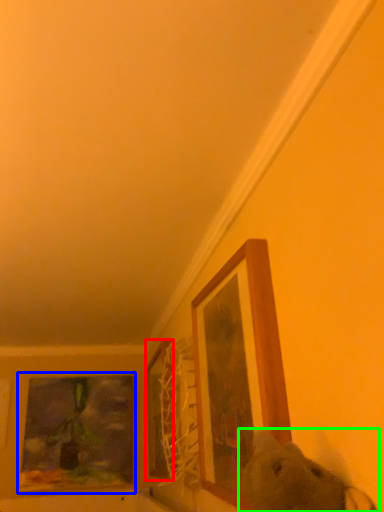
Question: Which object is positioned farthest from picture frame (highlighted by a red box)? Select from picture frame (highlighted by a blue box) and animal (highlighted by a green box).

Choices:
 (A) picture frame
 (B) animal

Answer: (B)